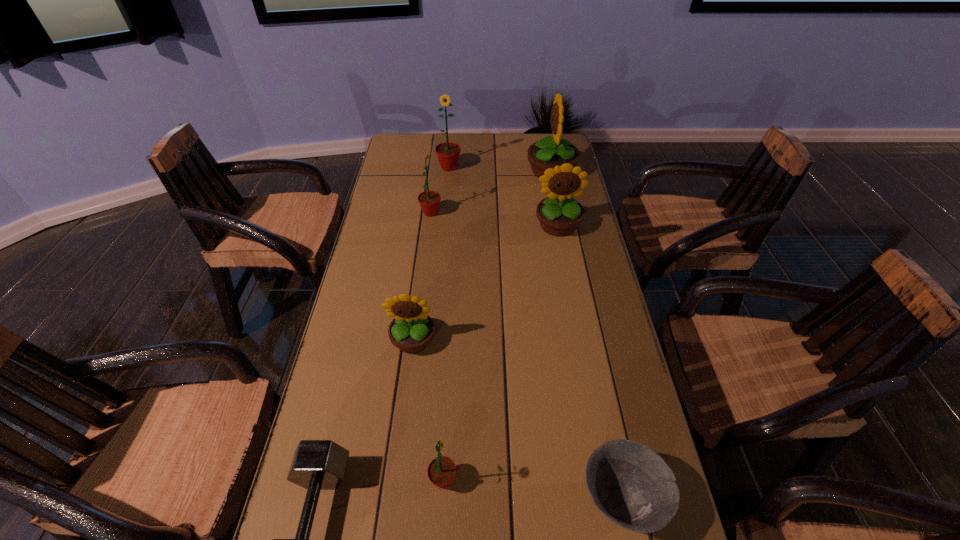
Locate an element on the screen. Image resolution: width=960 pixels, height=540 pixels. the farthest yellow sunflower is located at coordinates (548, 152).

Where is `the farthest green sunflower`? The image size is (960, 540). the farthest green sunflower is located at coordinates (448, 153).

What are the coordinates of `the second farthest yellow sunflower` in the screenshot? It's located at (560, 214).

Where is `the second smallest green sunflower`? the second smallest green sunflower is located at coordinates (429, 201).

This screenshot has width=960, height=540. I want to click on the nearest yellow sunflower, so click(x=411, y=330).

Identify the location of the fifth farthest sunflower. The height and width of the screenshot is (540, 960). (411, 330).

Find the location of a particular element. This screenshot has width=960, height=540. the nearest green sunflower is located at coordinates (441, 471).

You are a GUI agent. You are given a task and a screenshot of the screen. Output one action in this format:
    pyautogui.click(x=<x>, y=<y>)
    Task: Click on the smallest green sunflower
    
    Given the screenshot: What is the action you would take?
    pyautogui.click(x=441, y=471)

The width and height of the screenshot is (960, 540). I want to click on vacant space located 0.210m on the face of the farthest yellow sunflower, so click(472, 171).

Find the location of a particular element. vacant region located 0.250m on the face of the farthest yellow sunflower is located at coordinates (463, 171).